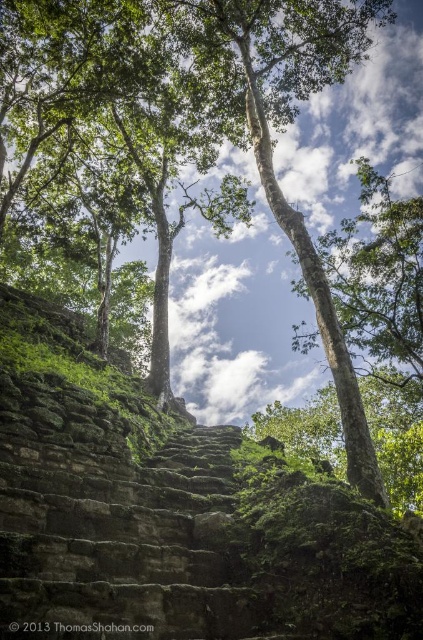
You are an archaeologist standing in front of the green mossy stone steps at center in the jungle. You need to reach the top of the steps, which are 10 meters away from your current position. Can you safely walk up the steps?

The distance between you and the green mossy stone steps at center is 5.98 meters, which is less than the 10 meters required to reach the top. Therefore, you can safely walk up the steps.

You are an archaeologist examining the ancient structure. You notice two sets of green mossy stone steps at center and green mossy stone stairs at center. Which one has a higher elevation?

The green mossy stone steps at center has a greater height compared to the green mossy stone stairs at center, so the green mossy stone steps at center is higher in elevation.

You are standing at the base of the ancient stone steps in the jungle. You notice two points marked on the steps. One is at coordinate point (235, 435) and the other at point (101, 586). If you are facing upwards along the steps, which point is closer to you?

Point (101, 586) is closer to you because it is in front of point (235, 435) when facing upwards along the steps.